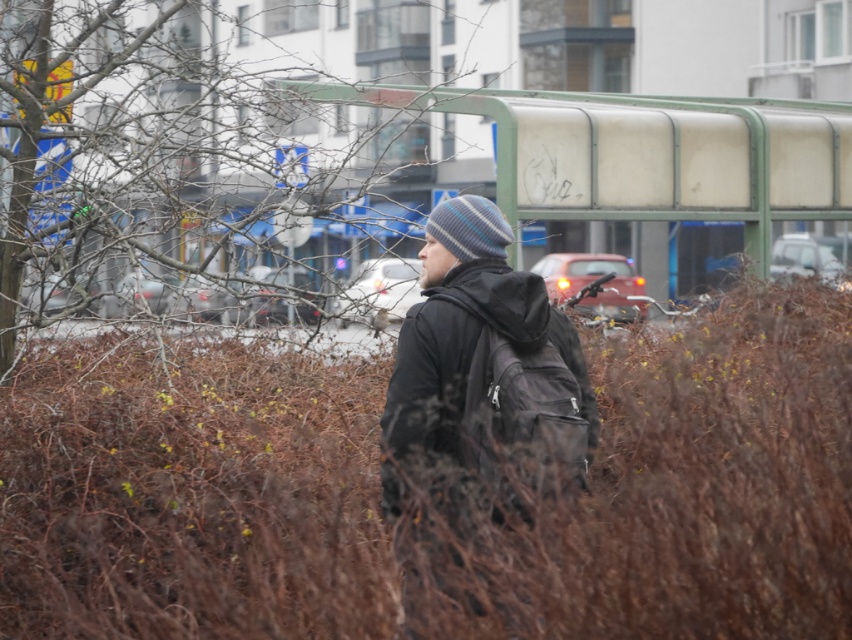
You are a pedestrian trying to take a shortcut through the brown dry bush at center and the bare branches at center. Which object is closer to the ground?

The brown dry bush at center is closer to the ground since it is positioned below the bare branches at center.

You are a photographer trying to capture the urban scene with the bare branches at center and the black matte jacket at center in the frame. Which object should you focus on first if you want to emphasize the larger one?

You should focus on the bare branches at center first because they are larger in size compared to the black matte jacket at center.